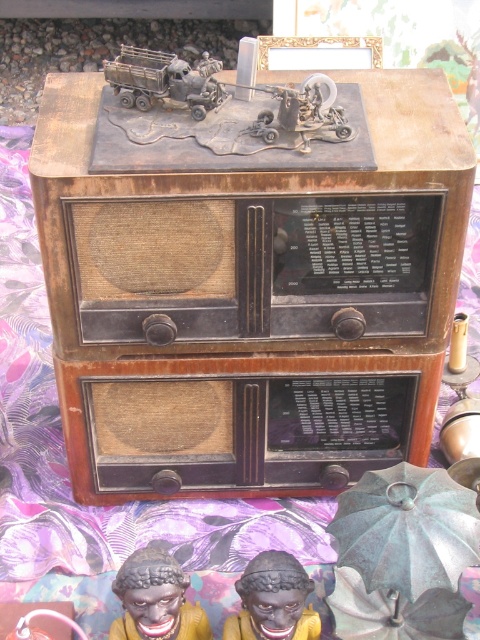
You are arranging items on a desk and need to place both the brown wood table at center and the matte black figurine at lower left. Based on the scene, which object is positioned higher up?

The brown wood table at center is located above the matte black figurine at lower left, so it is positioned higher up.

You are standing in front of the vintage wooden radio set. There is a green patina metal umbrella at lower right. Where is the point located at coordinates (407, 529) on the image?

The point at coordinates (407, 529) corresponds to the green patina metal umbrella at lower right.